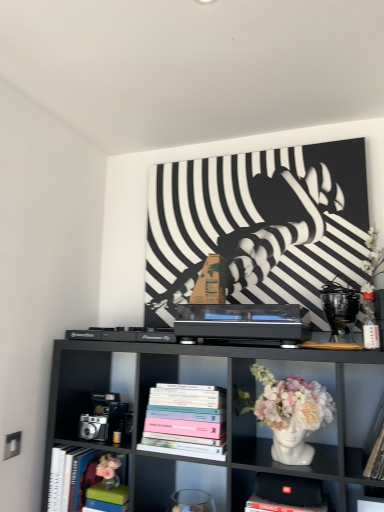
Locate an element on the screen. black plastic toy at upper right, placed as the 2th toy when sorted from left to right is located at coordinates (339, 310).

This screenshot has height=512, width=384. What do you see at coordinates (105, 418) in the screenshot?
I see `metallic silver camera at lower left, the first toy when ordered from bottom to top` at bounding box center [105, 418].

The image size is (384, 512). What do you see at coordinates (227, 413) in the screenshot?
I see `black matte shelf at center, the 2th shelf positioned from the bottom` at bounding box center [227, 413].

Locate an element on the screen. The width and height of the screenshot is (384, 512). black fabric speaker at lower center, which ranks as the 2th shelf in top-to-bottom order is located at coordinates (241, 487).

I want to click on white glossy vase at center, so click(x=291, y=413).

Image resolution: width=384 pixels, height=512 pixels. I want to click on hardcover books at center, positioned as the first book in top-to-bottom order, so click(186, 421).

Is hardcover books at center, positioned as the first book in top-to-bottom order, thinner than metallic silver camera at lower left, the 1th toy from the left?

No.

Are hardcover books at center, positioned as the first book in top-to-bottom order, and metallic silver camera at lower left, the 1th toy from the left, beside each other?

No.

From the image's perspective, which one is positioned lower, black plastic toy at upper right, placed as the 2th toy when sorted from left to right, or metallic silver camera at lower left, the 1th toy from the left?

metallic silver camera at lower left, the 1th toy from the left.

Could you tell me if black plastic toy at upper right, the 1th toy when ordered from top to bottom, is turned towards metallic silver camera at lower left, the first toy when ordered from bottom to top?

No.

Which object is further away from the camera taking this photo, black plastic toy at upper right, the 1th toy when ordered from top to bottom, or metallic silver camera at lower left, the 1th toy from the left?

metallic silver camera at lower left, the 1th toy from the left, is further from the camera.

Can you confirm if black plastic toy at upper right, marked as the 1th toy in a right-to-left arrangement, is taller than metallic silver camera at lower left, the first toy when ordered from bottom to top?

Indeed, black plastic toy at upper right, marked as the 1th toy in a right-to-left arrangement, has a greater height compared to metallic silver camera at lower left, the first toy when ordered from bottom to top.

What's the angular difference between hardcover book at left, positioned as the first book in bottom-to-top order, and black fabric speaker at lower center, which ranks as the 2th shelf in top-to-bottom order,'s facing directions?

hardcover book at left, positioned as the first book in bottom-to-top order, and black fabric speaker at lower center, which ranks as the 2th shelf in top-to-bottom order, are facing 1.78 degrees away from each other.

Considering the relative positions of hardcover book at left, positioned as the first book in bottom-to-top order, and black fabric speaker at lower center, which ranks as the 2th shelf in top-to-bottom order, in the image provided, is hardcover book at left, positioned as the first book in bottom-to-top order, to the left or to the right of black fabric speaker at lower center, which ranks as the 2th shelf in top-to-bottom order,?

hardcover book at left, positioned as the first book in bottom-to-top order, is positioned on black fabric speaker at lower center, which ranks as the 2th shelf in top-to-bottom order,'s left side.

Starting from the black fabric speaker at lower center, which is counted as the first shelf, starting from the bottom, which book is the 2nd one to the left? Please provide its 2D coordinates.

[(75, 476)]

Considering the positions of points (73, 490) and (335, 490), is point (73, 490) closer to camera compared to point (335, 490)?

No, (73, 490) is further to viewer.

Can you tell me how much black matte shelf at center, placed as the 1th shelf when sorted from top to bottom, and hardcover book at left, positioned as the first book in bottom-to-top order, differ in facing direction?

The angle between the facing direction of black matte shelf at center, placed as the 1th shelf when sorted from top to bottom, and the facing direction of hardcover book at left, positioned as the first book in bottom-to-top order, is 1.97 degrees.

From the image's perspective, is black matte shelf at center, placed as the 1th shelf when sorted from top to bottom, beneath hardcover book at left, placed as the 1th book when sorted from left to right?

No, from the image's perspective, black matte shelf at center, placed as the 1th shelf when sorted from top to bottom, is not below hardcover book at left, placed as the 1th book when sorted from left to right.

Based on the photo, does black matte shelf at center, placed as the 1th shelf when sorted from top to bottom, turn towards hardcover book at left, the second book in the top-to-bottom sequence?

Yes, black matte shelf at center, placed as the 1th shelf when sorted from top to bottom, is aimed at hardcover book at left, the second book in the top-to-bottom sequence.

From the image's perspective, which is above, white glossy vase at center or black matte shelf at center, the 2th shelf positioned from the bottom?

From the image's view, white glossy vase at center is above.

Between white glossy vase at center and black matte shelf at center, placed as the 1th shelf when sorted from top to bottom, which one appears on the left side from the viewer's perspective?

From the viewer's perspective, black matte shelf at center, placed as the 1th shelf when sorted from top to bottom, appears more on the left side.

Which point is more distant from viewer, (273,414) or (340,360)?

Point (340,360)

In the image, is white glossy vase at center positioned in front of or behind black matte shelf at center, the 2th shelf positioned from the bottom?

Visually, white glossy vase at center is located behind black matte shelf at center, the 2th shelf positioned from the bottom.

Is black plastic toy at upper right, marked as the 1th toy in a right-to-left arrangement, facing away from black matte shelf at center, the 2th shelf positioned from the bottom?

No, black plastic toy at upper right, marked as the 1th toy in a right-to-left arrangement, is not facing away from black matte shelf at center, the 2th shelf positioned from the bottom.

Can you confirm if black plastic toy at upper right, marked as the 1th toy in a right-to-left arrangement, is positioned to the left of black matte shelf at center, the 2th shelf positioned from the bottom?

In fact, black plastic toy at upper right, marked as the 1th toy in a right-to-left arrangement, is to the right of black matte shelf at center, the 2th shelf positioned from the bottom.

Locate an element on the screen. The width and height of the screenshot is (384, 512). the 2nd shelf counting from the left side of the black plastic toy at upper right, positioned as the 2th toy in bottom-to-top order is located at coordinates (227, 413).

Visually, is hardcover book at left, the 2th book from the right, positioned to the left or to the right of black matte shelf at center, the 2th shelf positioned from the bottom?

From the image, it's evident that hardcover book at left, the 2th book from the right, is to the left of black matte shelf at center, the 2th shelf positioned from the bottom.

Is hardcover book at left, the 2th book from the right, in front of or behind black matte shelf at center, placed as the 1th shelf when sorted from top to bottom, in the image?

Visually, hardcover book at left, the 2th book from the right, is located behind black matte shelf at center, placed as the 1th shelf when sorted from top to bottom.

Is hardcover book at left, the second book in the top-to-bottom sequence, smaller than black matte shelf at center, placed as the 1th shelf when sorted from top to bottom?

Yes, hardcover book at left, the second book in the top-to-bottom sequence, is smaller than black matte shelf at center, placed as the 1th shelf when sorted from top to bottom.

Consider the image. Could you tell me if hardcover book at left, the 2th book from the right, is facing black matte shelf at center, the 2th shelf positioned from the bottom?

Yes.

Find the location of a particular element. The image size is (384, 512). toy lying below the hardcover books at center, placed as the 1th book when sorted from right to left (from the image's perspective) is located at coordinates (105, 418).

You are a GUI agent. You are given a task and a screenshot of the screen. Output one action in this format:
    pyautogui.click(x=<x>, y=<y>)
    Task: Click on the toy above the metallic silver camera at lower left, positioned as the second toy in top-to-bottom order (from the image's perspective)
    The width and height of the screenshot is (384, 512).
    Given the screenshot: What is the action you would take?
    pyautogui.click(x=339, y=310)

Considering their positions, is hardcover book at left, the second book in the top-to-bottom sequence, positioned closer to hardcover books at center, placed as the 1th book when sorted from right to left, than black fabric speaker at lower center, which ranks as the 2th shelf in top-to-bottom order?

black fabric speaker at lower center, which ranks as the 2th shelf in top-to-bottom order, lies closer to hardcover books at center, placed as the 1th book when sorted from right to left, than the other object.

When comparing their distances from white glossy vase at center, does black plastic toy at upper right, placed as the 2th toy when sorted from left to right, or metallic silver camera at lower left, the 1th toy from the left, seem further?

The object further to white glossy vase at center is metallic silver camera at lower left, the 1th toy from the left.

Considering their positions, is hardcover book at left, placed as the 1th book when sorted from left to right, positioned closer to hardcover books at center, which is counted as the second book, starting from the bottom, than black plastic toy at upper right, marked as the 1th toy in a right-to-left arrangement?

Among the two, hardcover book at left, placed as the 1th book when sorted from left to right, is located nearer to hardcover books at center, which is counted as the second book, starting from the bottom.

Considering their positions, is black plastic toy at upper right, positioned as the 2th toy in bottom-to-top order, positioned further to hardcover book at left, placed as the 1th book when sorted from left to right, than white glossy vase at center?

The object further to hardcover book at left, placed as the 1th book when sorted from left to right, is black plastic toy at upper right, positioned as the 2th toy in bottom-to-top order.

Which object lies further to the anchor point black matte shelf at center, the 2th shelf positioned from the bottom, hardcover book at left, placed as the 1th book when sorted from left to right, or black fabric speaker at lower center, which ranks as the 2th shelf in top-to-bottom order?

Based on the image, black fabric speaker at lower center, which ranks as the 2th shelf in top-to-bottom order, appears to be further to black matte shelf at center, the 2th shelf positioned from the bottom.

When comparing their distances from black plastic toy at upper right, the 1th toy when ordered from top to bottom, does white glossy vase at center or metallic silver camera at lower left, positioned as the second toy in top-to-bottom order, seem closer?

white glossy vase at center is closer to black plastic toy at upper right, the 1th toy when ordered from top to bottom.

When comparing their distances from black fabric speaker at lower center, which ranks as the 2th shelf in top-to-bottom order, does white glossy vase at center or hardcover books at center, which is counted as the second book, starting from the bottom, seem further?

white glossy vase at center lies further to black fabric speaker at lower center, which ranks as the 2th shelf in top-to-bottom order, than the other object.

Which object lies nearer to the anchor point hardcover book at left, the 2th book from the right, white glossy vase at center or hardcover books at center, placed as the 1th book when sorted from right to left?

hardcover books at center, placed as the 1th book when sorted from right to left, is positioned closer to the anchor hardcover book at left, the 2th book from the right.

This screenshot has height=512, width=384. I want to click on shelf between hardcover books at center, acting as the second book starting from the left, and black fabric speaker at lower center, which is counted as the first shelf, starting from the bottom, from left to right, so click(227, 413).

Locate an element on the screen. The width and height of the screenshot is (384, 512). book located between hardcover book at left, the second book in the top-to-bottom sequence, and black plastic toy at upper right, the 1th toy when ordered from top to bottom, in the left-right direction is located at coordinates (186, 421).

The image size is (384, 512). Find the location of `book between metallic silver camera at lower left, positioned as the second toy in top-to-bottom order, and black matte shelf at center, placed as the 1th shelf when sorted from top to bottom`. book between metallic silver camera at lower left, positioned as the second toy in top-to-bottom order, and black matte shelf at center, placed as the 1th shelf when sorted from top to bottom is located at coordinates (186, 421).

Locate an element on the screen. The height and width of the screenshot is (512, 384). floral arrangement between black plastic toy at upper right, marked as the 1th toy in a right-to-left arrangement, and black matte shelf at center, placed as the 1th shelf when sorted from top to bottom, in the vertical direction is located at coordinates (291, 413).